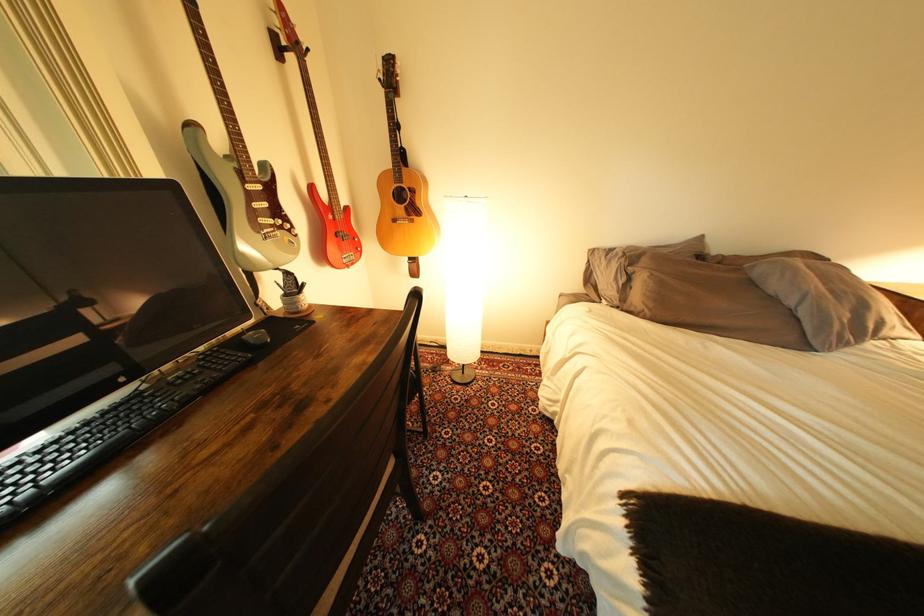
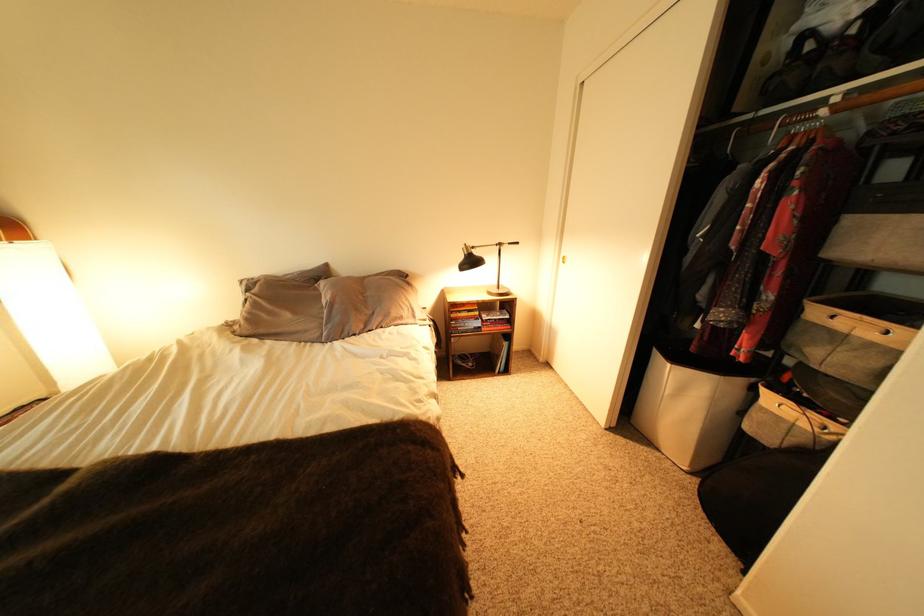
Question: Which direction would the cameraman need to move to produce the second image? Reply with the corresponding letter.

Choices:
 (A) Left
 (B) Right
 (C) Forward
 (D) Backward

Answer: (B)